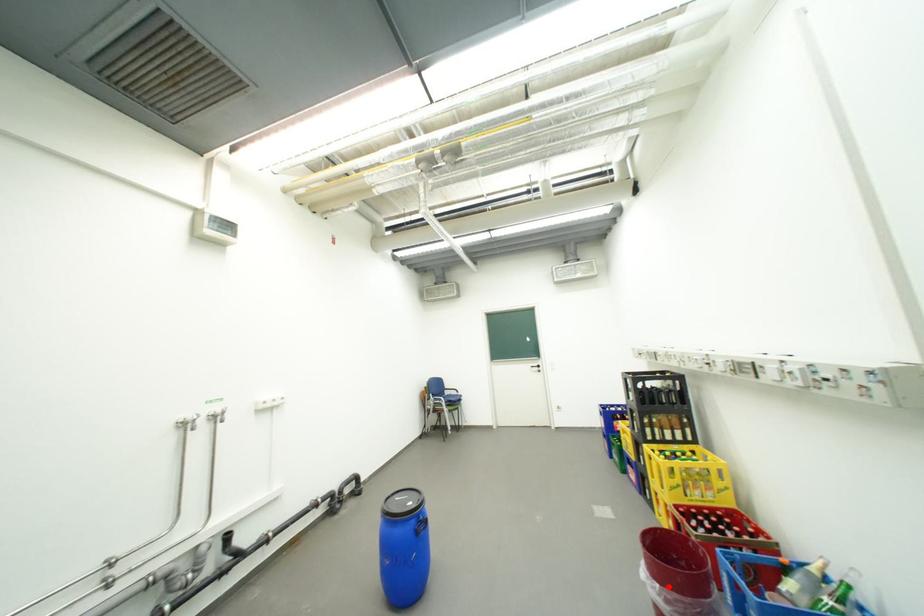
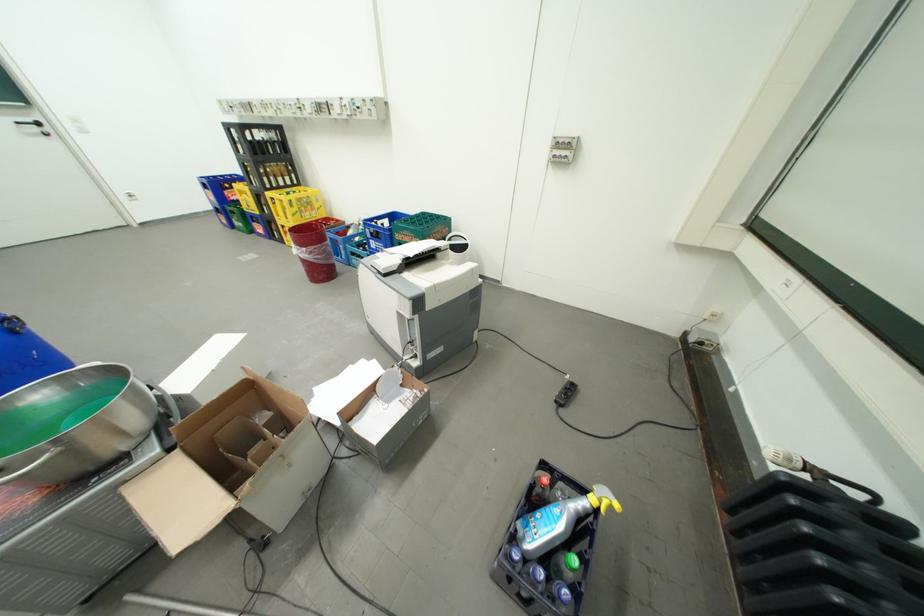
Question: I am providing you with two images of the same scene from different viewpoints. Given a red point in image1, look at the same physical point in image2. Is it:

Choices:
 (A) Closer to the viewpoint
 (B) Farther from the viewpoint

Answer: (A)